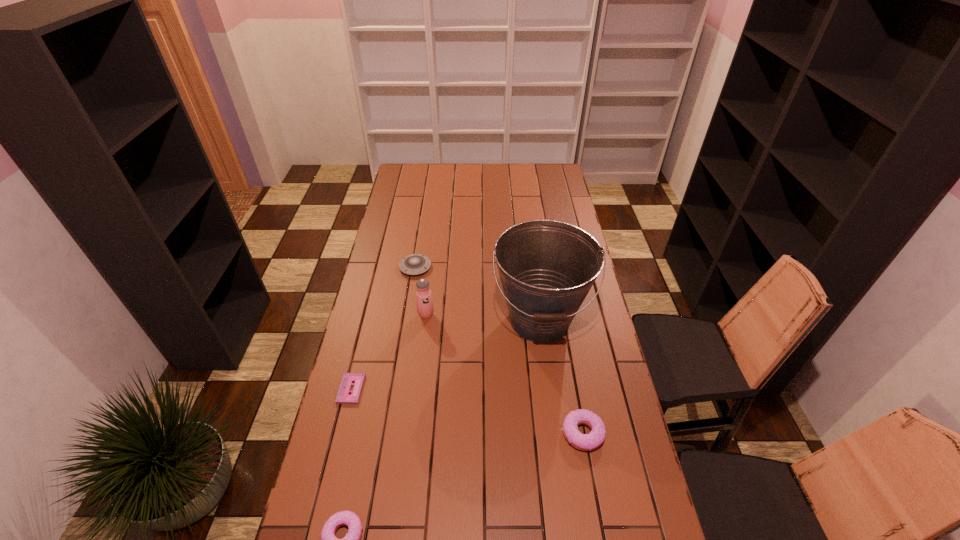
You are a GUI agent. You are given a task and a screenshot of the screen. Output one action in this format:
    pyautogui.click(x=<x>, y=<y>)
    Task: Click on the blank space that satisfies the following two spatial constraints: 1. on the back side of the farthest object; 2. on the right side of the fourth farthest object
    Image resolution: width=960 pixels, height=540 pixels.
    Given the screenshot: What is the action you would take?
    pyautogui.click(x=381, y=267)